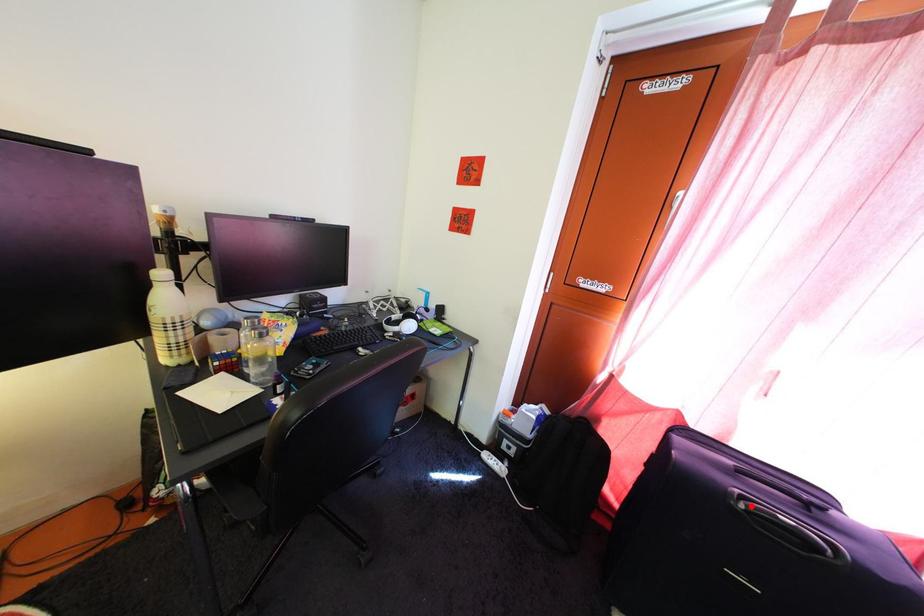
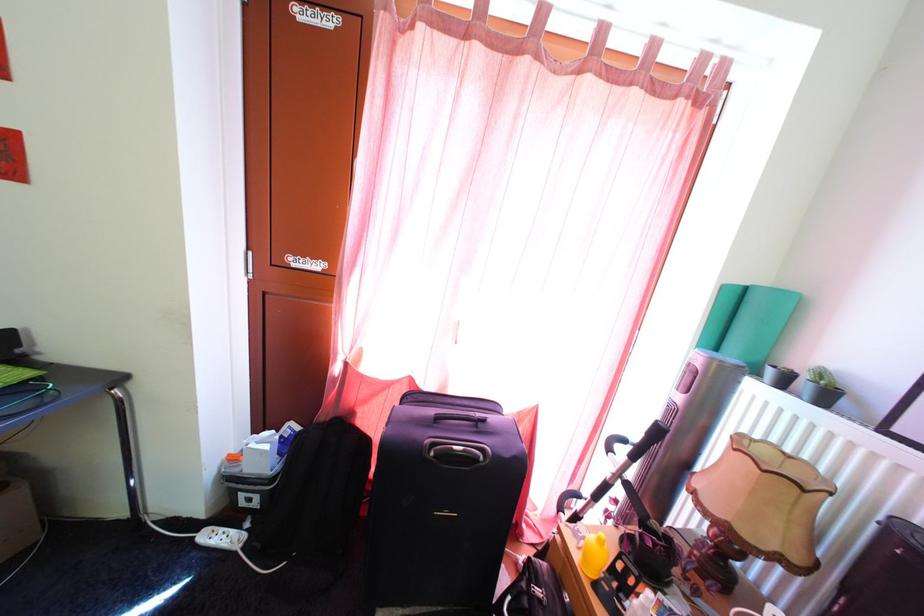
Find the pixel in the second image that matches the highlighted location in the first image.

(441, 454)